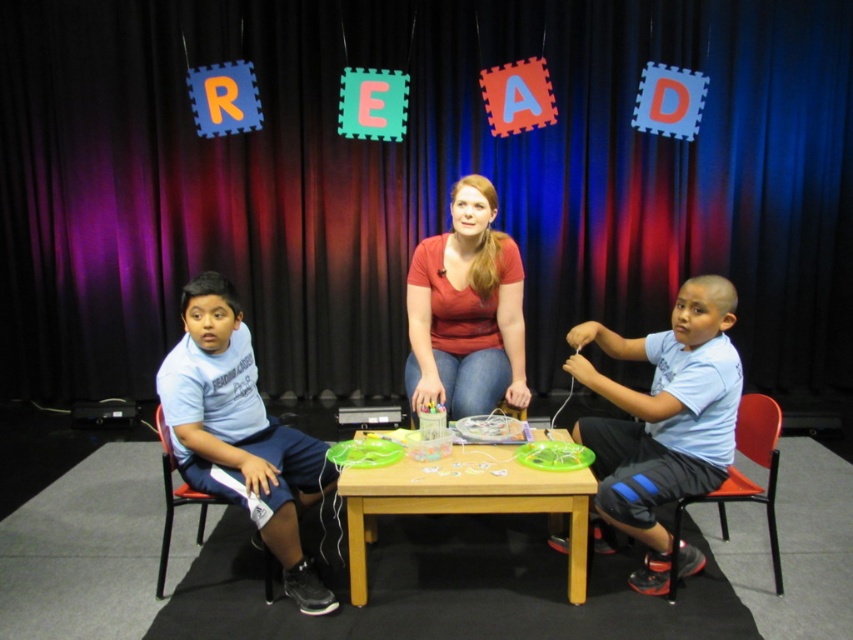
You are standing at the back of the scene looking toward the table. Which of the two points, point (442, 312) or point (456, 467), is closer to you?

Point (442, 312) is further to the camera than point (456, 467), so the closer point to you would be point (456, 467).

You are organizing a reading event and need to ensure that the matte red shirt at center and the orange plastic chair at right can fit side by side on a narrow shelf. Based on their widths, will they both fit if the shelf is 1.2 meters wide?

The matte red shirt at center has a lesser width compared to orange plastic chair at right. However, without knowing the exact widths of both items, it is impossible to determine if they will fit on a 1.2 meter shelf. More information is needed.